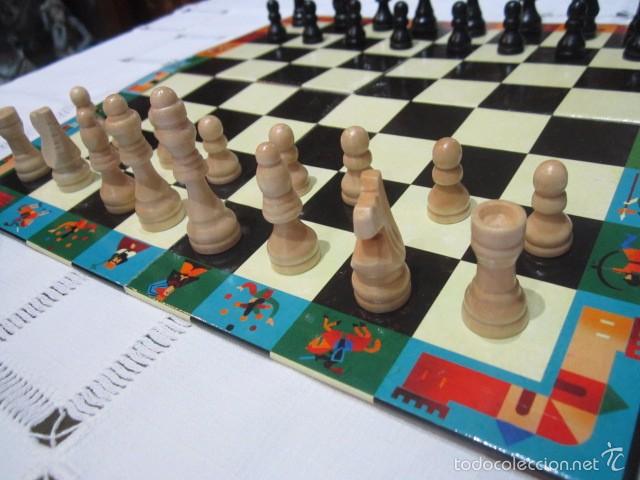
In order to click on dark space near table in this screenshot , I will do `click(57, 19)`.